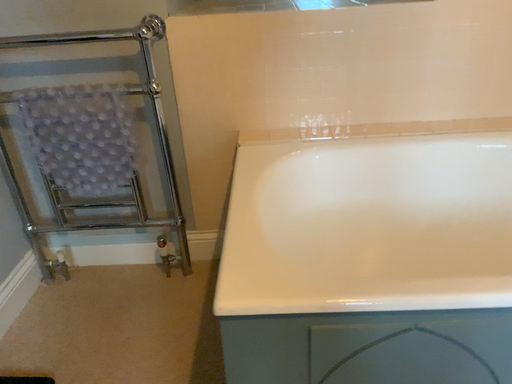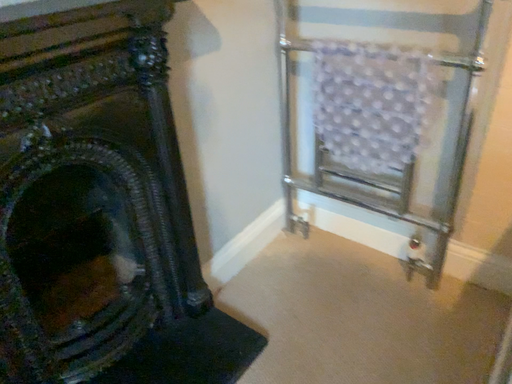
Question: How did the camera likely rotate when shooting the video?

Choices:
 (A) rotated right
 (B) rotated left

Answer: (B)